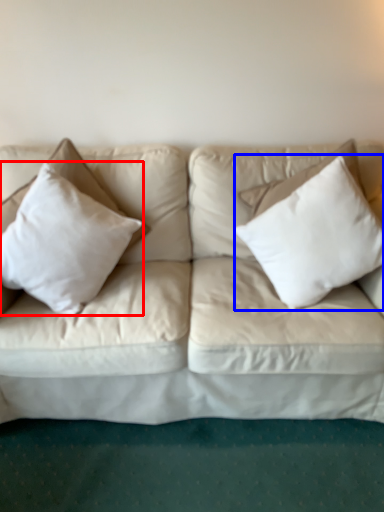
Question: Among these objects, which one is nearest to the camera, pillow (highlighted by a red box) or pillow (highlighted by a blue box)?

Choices:
 (A) pillow
 (B) pillow

Answer: (A)